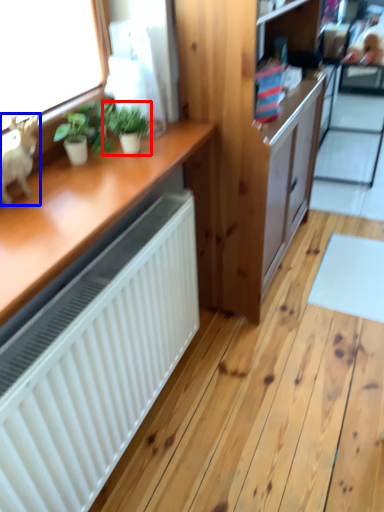
Question: Which point is further to the camera, houseplant (highlighted by a red box) or animal (highlighted by a blue box)?

Choices:
 (A) houseplant
 (B) animal

Answer: (A)